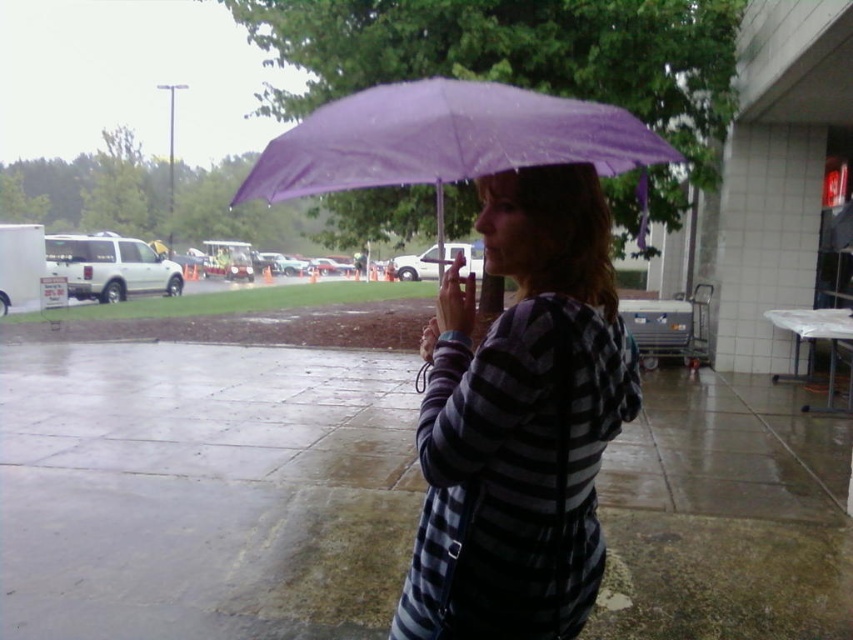
Does striped fabric hoodie at center appear over purple matte umbrella at center?

No, striped fabric hoodie at center is not above purple matte umbrella at center.

Who is more distant from viewer, (x=519, y=426) or (x=495, y=125)?

The point (x=519, y=426) is more distant.

Identify the location of striped fabric hoodie at center. (520, 420).